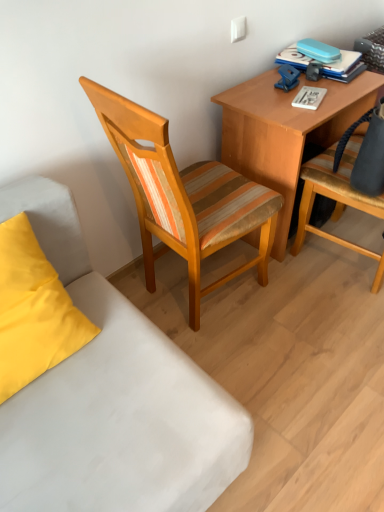
Question: Can you confirm if blue hardcover book at upper right is smaller than woodenchair at center, marked as the second chair in a right-to-left arrangement?

Choices:
 (A) no
 (B) yes

Answer: (B)

Question: From the image's perspective, is blue hardcover book at upper right under woodenchair at center, the first chair when ordered from left to right?

Choices:
 (A) no
 (B) yes

Answer: (A)

Question: Considering the relative positions of blue hardcover book at upper right and woodenchair at center, the first chair when ordered from left to right, in the image provided, is blue hardcover book at upper right to the right of woodenchair at center, the first chair when ordered from left to right, from the viewer's perspective?

Choices:
 (A) yes
 (B) no

Answer: (A)

Question: Considering the relative sizes of blue hardcover book at upper right and woodenchair at center, marked as the second chair in a right-to-left arrangement, in the image provided, is blue hardcover book at upper right shorter than woodenchair at center, marked as the second chair in a right-to-left arrangement,?

Choices:
 (A) yes
 (B) no

Answer: (A)

Question: Can you confirm if blue hardcover book at upper right is wider than woodenchair at center, the first chair when ordered from left to right?

Choices:
 (A) yes
 (B) no

Answer: (B)

Question: Looking at their shapes, would you say matte yellow pillow at lower left is wider or thinner than white fabric couch at lower left?

Choices:
 (A) wide
 (B) thin

Answer: (B)

Question: Is point [28, 382] positioned closer to the camera than point [152, 372]?

Choices:
 (A) closer
 (B) farther

Answer: (A)

Question: Is matte yellow pillow at lower left to the left or to the right of white fabric couch at lower left in the image?

Choices:
 (A) right
 (B) left

Answer: (B)

Question: From the image's perspective, is matte yellow pillow at lower left located above or below white fabric couch at lower left?

Choices:
 (A) below
 (B) above

Answer: (B)

Question: Is point (337, 130) positioned closer to the camera than point (62, 325)?

Choices:
 (A) farther
 (B) closer

Answer: (A)

Question: From a real-world perspective, is wooden desk at upper right above or below matte yellow pillow at lower left?

Choices:
 (A) below
 (B) above

Answer: (A)

Question: In terms of width, does wooden desk at upper right look wider or thinner when compared to matte yellow pillow at lower left?

Choices:
 (A) thin
 (B) wide

Answer: (B)

Question: From the image's perspective, is wooden desk at upper right positioned above or below matte yellow pillow at lower left?

Choices:
 (A) above
 (B) below

Answer: (A)

Question: Is striped fabric chair at right, placed as the 2th chair when sorted from left to right, in front of or behind woodenchair at center, marked as the second chair in a right-to-left arrangement, in the image?

Choices:
 (A) behind
 (B) front

Answer: (A)

Question: Is striped fabric chair at right, placed as the 2th chair when sorted from left to right, spatially inside woodenchair at center, marked as the second chair in a right-to-left arrangement, or outside of it?

Choices:
 (A) outside
 (B) inside

Answer: (A)